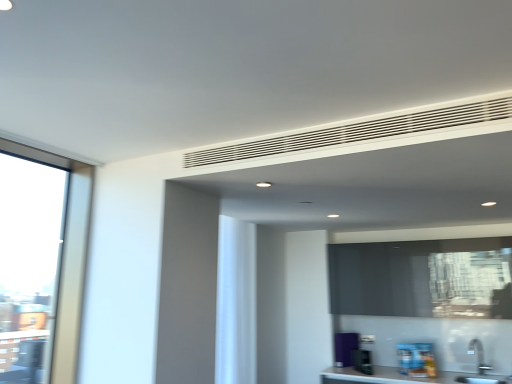
Identify the location of blank space situated above white matte vent at upper center (from a real-world perspective). The image size is (512, 384). (328, 119).